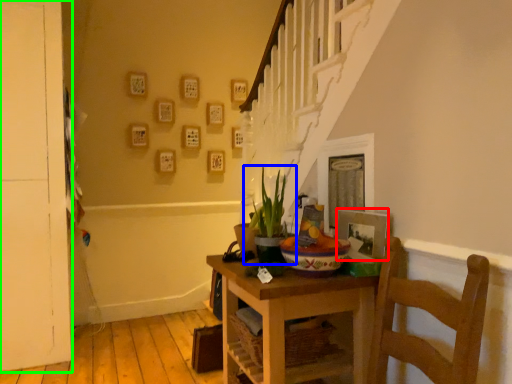
Question: Estimate the real-world distances between objects in this image. Which object is farther from picture frame (highlighted by a red box), houseplant (highlighted by a blue box) or door (highlighted by a green box)?

Choices:
 (A) houseplant
 (B) door

Answer: (B)